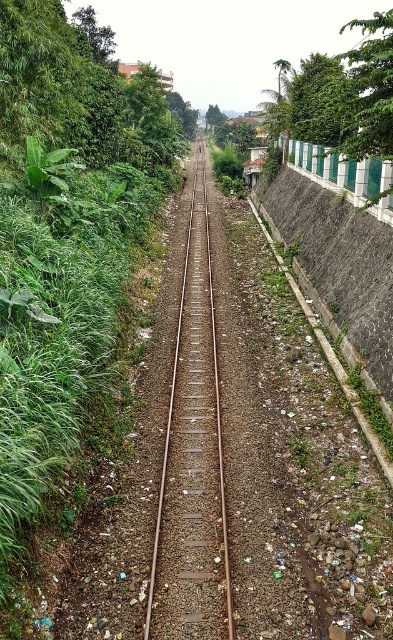
Which is above, green leafy vegetation at center or rusty metal train track at center?

green leafy vegetation at center is above.

Looking at this image, can you confirm if green leafy vegetation at center is positioned above rusty metal train track at center?

Yes, green leafy vegetation at center is above rusty metal train track at center.

This screenshot has width=393, height=640. Find the location of `green leafy vegetation at center`. green leafy vegetation at center is located at coordinates (64, 236).

Where is `green leafy vegetation at center`? This screenshot has width=393, height=640. green leafy vegetation at center is located at coordinates (64, 236).